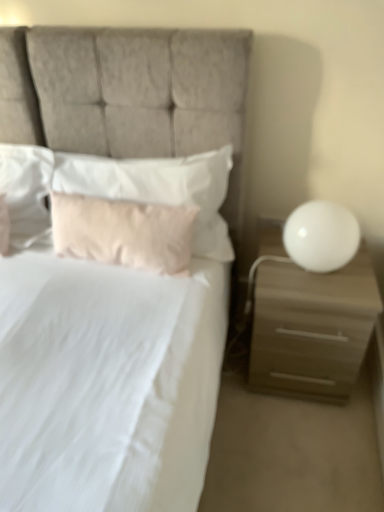
The width and height of the screenshot is (384, 512). I want to click on free location to the left of white glossy sphere at right, so click(x=268, y=271).